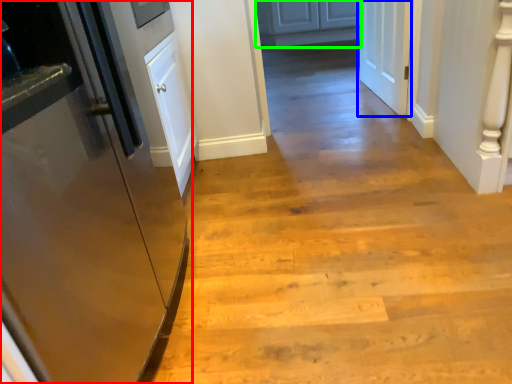
Question: Which is nearer to the door (highlighted by a red box)? door (highlighted by a blue box) or cabinetry (highlighted by a green box).

Choices:
 (A) door
 (B) cabinetry

Answer: (A)